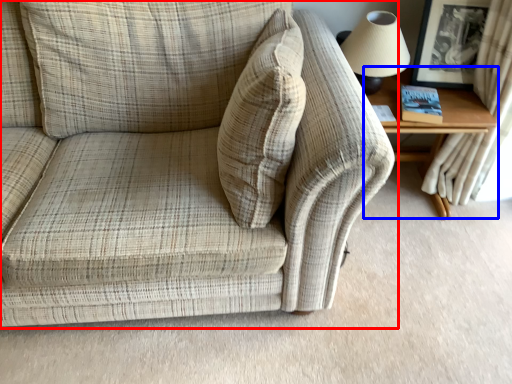
Question: Among these objects, which one is farthest to the camera, studio couch (highlighted by a red box) or table (highlighted by a blue box)?

Choices:
 (A) studio couch
 (B) table

Answer: (B)